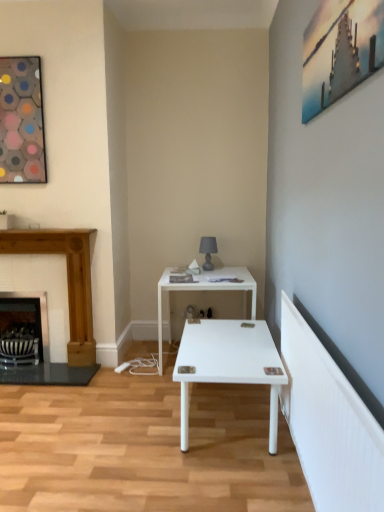
Question: Considering the relative sizes of metallic silver picture frame at upper right, the 2th picture frame when ordered from left to right, and black metal fireplace at left, the 1th fireplace when ordered from left to right, in the image provided, is metallic silver picture frame at upper right, the 2th picture frame when ordered from left to right, bigger than black metal fireplace at left, the 1th fireplace when ordered from left to right,?

Choices:
 (A) yes
 (B) no

Answer: (B)

Question: Are metallic silver picture frame at upper right, the 2th picture frame when ordered from left to right, and black metal fireplace at left, the 1th fireplace when ordered from left to right, far apart?

Choices:
 (A) no
 (B) yes

Answer: (B)

Question: Is black metal fireplace at left, the 2th fireplace from the right, completely or partially inside metallic silver picture frame at upper right, the second picture frame in the back-to-front sequence?

Choices:
 (A) yes
 (B) no

Answer: (B)

Question: Does metallic silver picture frame at upper right, which is counted as the first picture frame, starting from the front, have a lesser height compared to black metal fireplace at left, the 2th fireplace from the right?

Choices:
 (A) yes
 (B) no

Answer: (A)

Question: Is metallic silver picture frame at upper right, the 2th picture frame when ordered from left to right, further to the viewer compared to black metal fireplace at left, the 2th fireplace from the right?

Choices:
 (A) no
 (B) yes

Answer: (A)

Question: Is metallic silver picture frame at upper right, the first picture frame positioned from the right, wider than black metal fireplace at left, the 1th fireplace when ordered from left to right?

Choices:
 (A) yes
 (B) no

Answer: (B)

Question: Is wooden fireplace at left, which appears as the second fireplace when viewed from the left, with metallic silver picture frame at upper right, the 2th picture frame when ordered from left to right?

Choices:
 (A) yes
 (B) no

Answer: (B)

Question: Considering the relative sizes of wooden fireplace at left, which ranks as the 1th fireplace in right-to-left order, and metallic silver picture frame at upper right, the 2th picture frame when ordered from left to right, in the image provided, is wooden fireplace at left, which ranks as the 1th fireplace in right-to-left order, thinner than metallic silver picture frame at upper right, the 2th picture frame when ordered from left to right,?

Choices:
 (A) yes
 (B) no

Answer: (B)

Question: Is metallic silver picture frame at upper right, the second picture frame in the back-to-front sequence, at the back of wooden fireplace at left, which appears as the second fireplace when viewed from the left?

Choices:
 (A) yes
 (B) no

Answer: (B)

Question: From the image's perspective, is wooden fireplace at left, which appears as the second fireplace when viewed from the left, over metallic silver picture frame at upper right, the second picture frame in the back-to-front sequence?

Choices:
 (A) yes
 (B) no

Answer: (B)

Question: Is wooden fireplace at left, which ranks as the 1th fireplace in right-to-left order, facing towards metallic silver picture frame at upper right, which is counted as the first picture frame, starting from the front?

Choices:
 (A) yes
 (B) no

Answer: (B)

Question: Does wooden fireplace at left, which appears as the second fireplace when viewed from the left, appear on the right side of metallic silver picture frame at upper right, the 2th picture frame when ordered from left to right?

Choices:
 (A) no
 (B) yes

Answer: (A)

Question: Does black metal fireplace at left, the 1th fireplace when ordered from left to right, have a greater height compared to wooden fireplace at left, which appears as the second fireplace when viewed from the left?

Choices:
 (A) no
 (B) yes

Answer: (A)